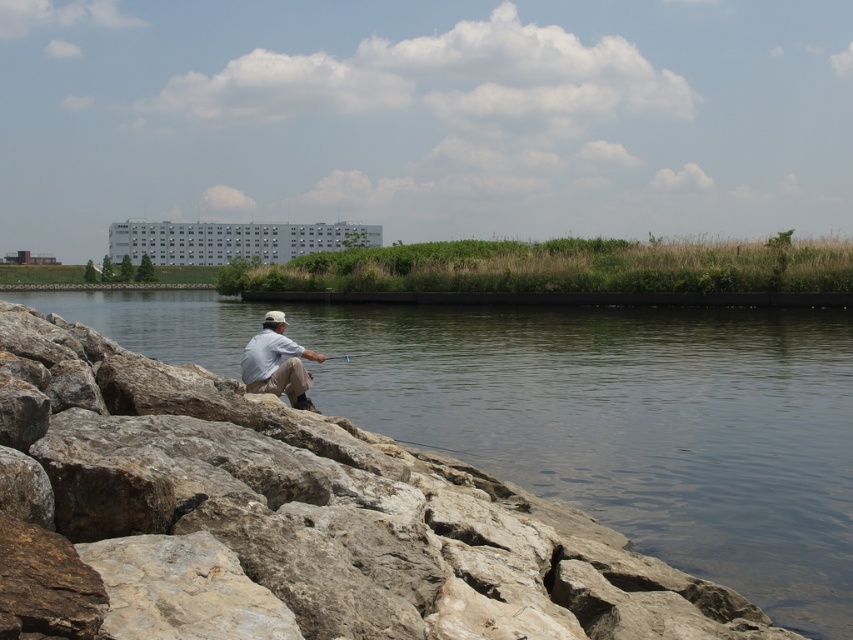
Question: Does clear water at lower left have a lesser width compared to light blue cotton shirt at center?

Choices:
 (A) no
 (B) yes

Answer: (A)

Question: Is clear water at lower left below light blue cotton shirt at center?

Choices:
 (A) yes
 (B) no

Answer: (B)

Question: Is clear water at lower left thinner than light blue cotton shirt at center?

Choices:
 (A) yes
 (B) no

Answer: (B)

Question: Among these points, which one is farthest from the camera?

Choices:
 (A) (297, 384)
 (B) (769, 492)

Answer: (A)

Question: Which point appears farthest from the camera in this image?

Choices:
 (A) (287, 381)
 (B) (587, 396)

Answer: (B)

Question: Which point appears closest to the camera in this image?

Choices:
 (A) (310, 352)
 (B) (780, 440)

Answer: (A)